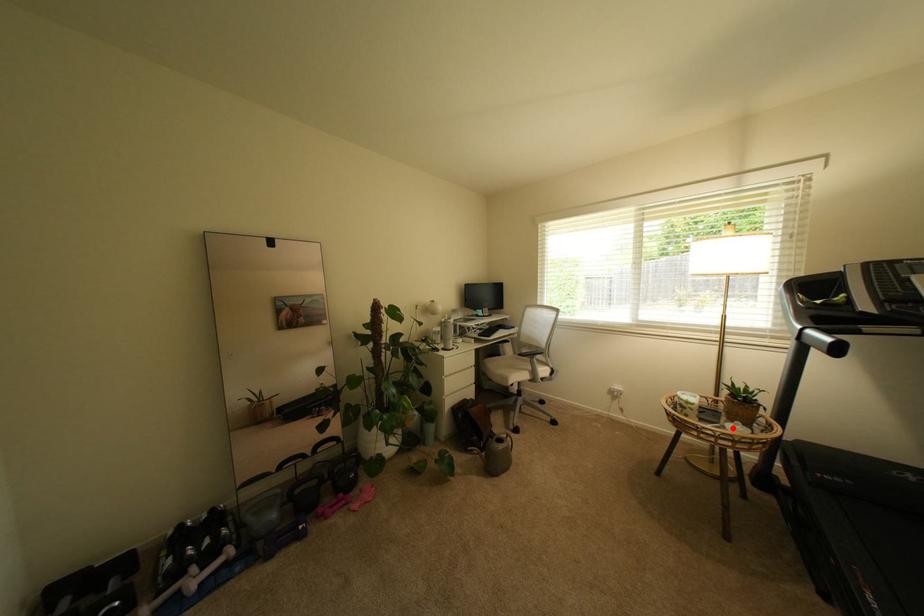
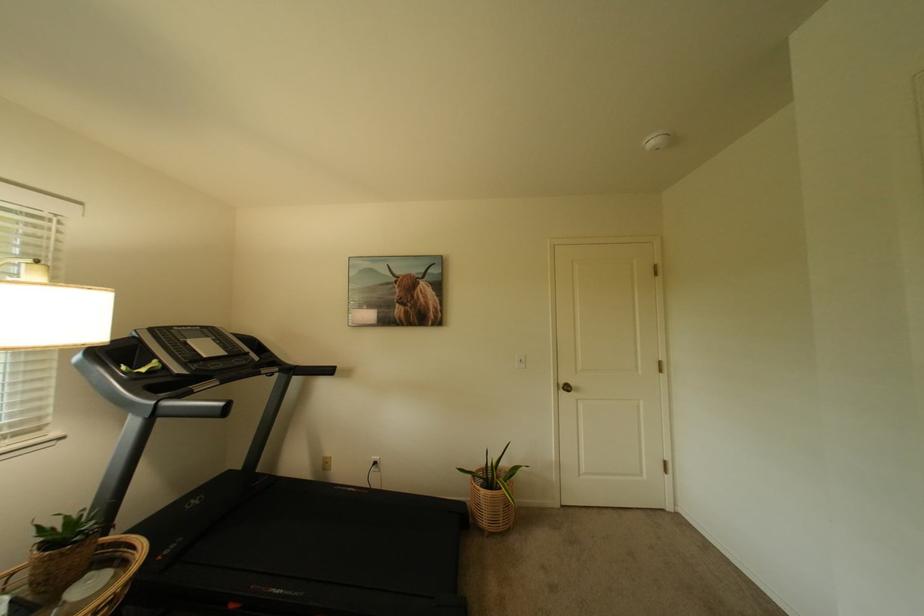
Question: I am providing you with two images of the same scene from different viewpoints. Image1 has a red point marked. In image2, the corresponding 3D location appears at what relative position? Reply with the corresponding letter.

Choices:
 (A) Closer
 (B) Farther

Answer: (A)